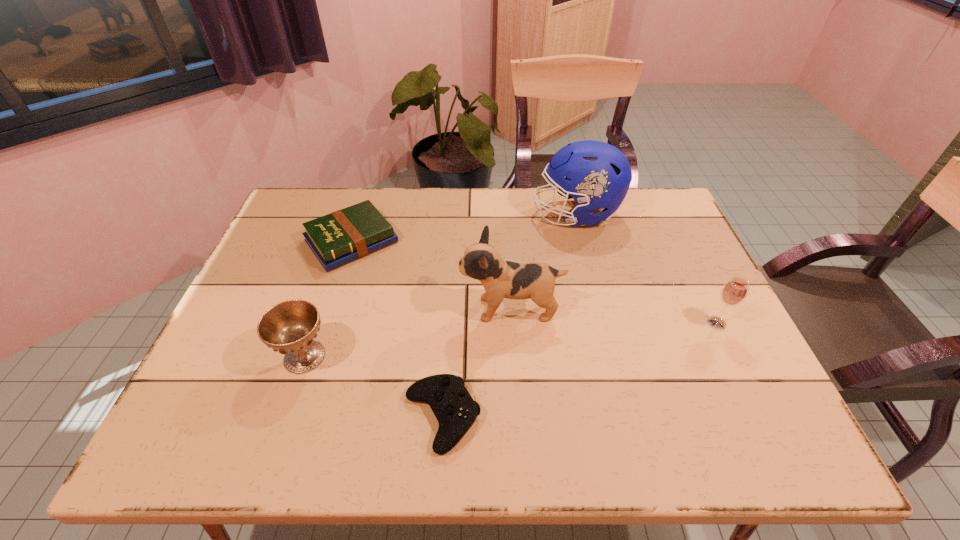
Locate an element on the screen. This screenshot has width=960, height=540. free space that is in between the book and the shortest object is located at coordinates (396, 329).

Where is `object that is the second nearest to the rightmost object`? This screenshot has height=540, width=960. object that is the second nearest to the rightmost object is located at coordinates (501, 279).

Locate which object ranks second in proximity to the chalice. Please provide its 2D coordinates. Your answer should be formatted as a tuple, i.e. [(x, y)], where the tuple contains the x and y coordinates of a point satisfying the conditions above.

[(345, 235)]

Image resolution: width=960 pixels, height=540 pixels. Identify the location of vacant space that satisfies the following two spatial constraints: 1. on the back side of the nearest object; 2. on the left side of the wineglass. (448, 323).

The image size is (960, 540). I want to click on vacant point that satisfies the following two spatial constraints: 1. at the face of the puppy; 2. on the left side of the wineglass, so click(512, 323).